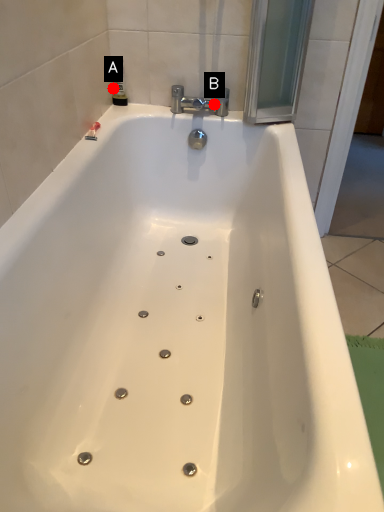
Question: Two points are circled on the image, labeled by A and B beside each circle. Which of the following is the farthest from the observer?

Choices:
 (A) A is further
 (B) B is further

Answer: (A)